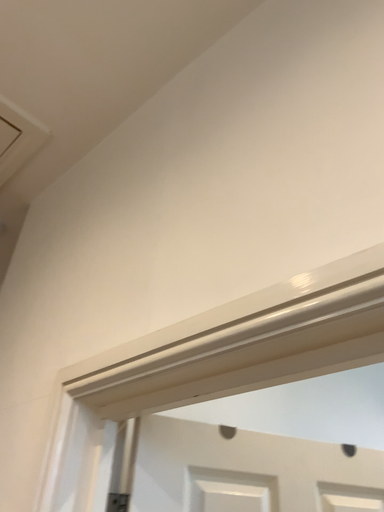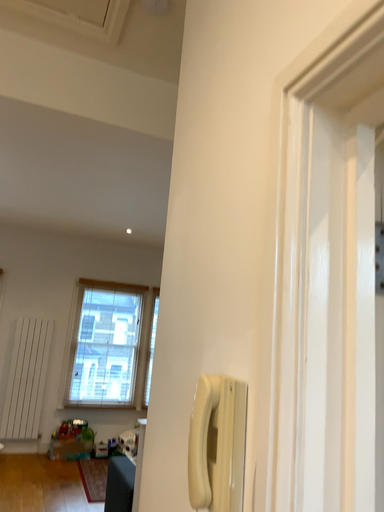
Question: Which way did the camera rotate in the video?

Choices:
 (A) rotated upward
 (B) rotated downward

Answer: (B)